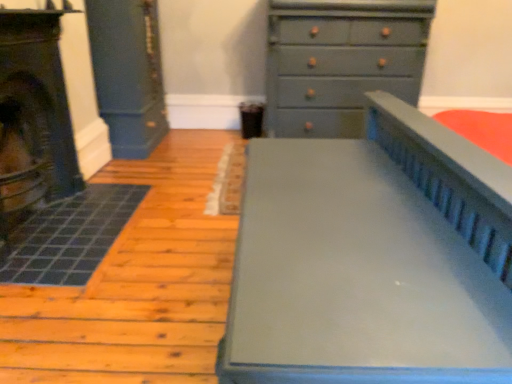
Question: From a real-world perspective, is matte gray bed at center on matte black fireplace at left?

Choices:
 (A) no
 (B) yes

Answer: (A)

Question: From the image's perspective, is matte gray bed at center above matte black fireplace at left?

Choices:
 (A) yes
 (B) no

Answer: (B)

Question: Can you confirm if matte gray bed at center is shorter than matte black fireplace at left?

Choices:
 (A) yes
 (B) no

Answer: (A)

Question: From a real-world perspective, is matte gray bed at center physically below matte black fireplace at left?

Choices:
 (A) yes
 (B) no

Answer: (A)

Question: Considering the relative sizes of matte gray bed at center and matte black fireplace at left in the image provided, is matte gray bed at center thinner than matte black fireplace at left?

Choices:
 (A) yes
 (B) no

Answer: (B)

Question: Can you confirm if matte gray bed at center is positioned to the right of matte black fireplace at left?

Choices:
 (A) yes
 (B) no

Answer: (A)

Question: From a real-world perspective, is matte black fireplace at left positioned under matte gray bed at center based on gravity?

Choices:
 (A) yes
 (B) no

Answer: (B)

Question: Is matte black fireplace at left outside of matte gray bed at center?

Choices:
 (A) no
 (B) yes

Answer: (B)

Question: From the image's perspective, is matte black fireplace at left below matte gray bed at center?

Choices:
 (A) yes
 (B) no

Answer: (B)

Question: Can you confirm if matte black fireplace at left is shorter than matte gray bed at center?

Choices:
 (A) yes
 (B) no

Answer: (B)

Question: Can matte gray bed at center be found inside matte black fireplace at left?

Choices:
 (A) yes
 (B) no

Answer: (B)

Question: Is matte black fireplace at left facing away from matte gray bed at center?

Choices:
 (A) yes
 (B) no

Answer: (B)

Question: Is matte gray chest of drawers at upper right positioned with its back to matte gray bed at center?

Choices:
 (A) yes
 (B) no

Answer: (B)